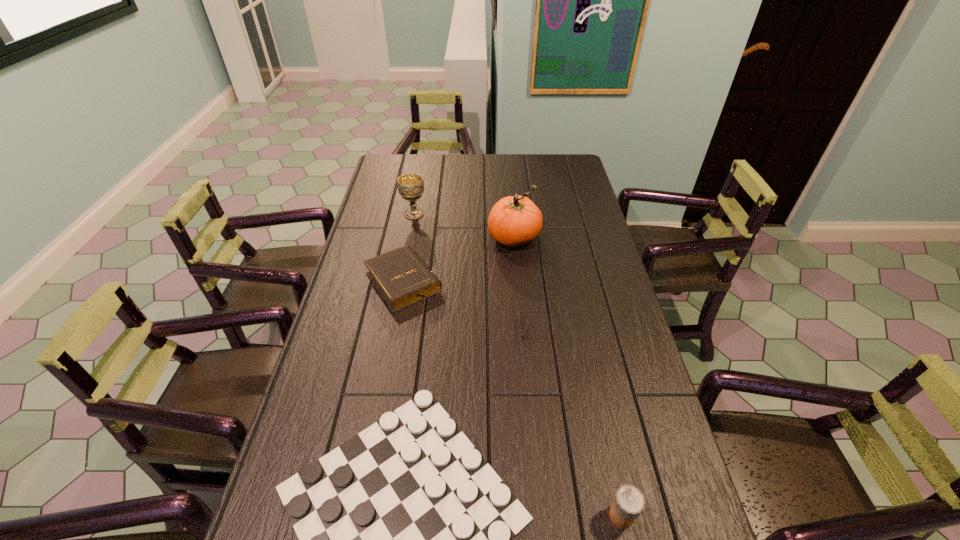
What are the coordinates of `free space at the far edge` in the screenshot? It's located at (444, 168).

You are a GUI agent. You are given a task and a screenshot of the screen. Output one action in this format:
    pyautogui.click(x=<x>, y=<y>)
    Task: Click on the blank space at the left edge of the desktop
    The width and height of the screenshot is (960, 540).
    Given the screenshot: What is the action you would take?
    pyautogui.click(x=369, y=243)

This screenshot has height=540, width=960. What are the coordinates of `vacant space at the right edge of the desktop` in the screenshot? It's located at (632, 377).

Where is `vacant point at the far left corner`? vacant point at the far left corner is located at coordinates (381, 175).

You are a GUI agent. You are given a task and a screenshot of the screen. Output one action in this format:
    pyautogui.click(x=<x>, y=<y>)
    Task: Click on the free space at the far right corner
    
    Given the screenshot: What is the action you would take?
    pyautogui.click(x=554, y=170)

Identify the location of free space between the third shortest object and the sunglasses. (472, 306).

The width and height of the screenshot is (960, 540). Find the location of `empty location between the tallest object and the medicine`. empty location between the tallest object and the medicine is located at coordinates (567, 376).

This screenshot has height=540, width=960. In order to click on free spot between the chalice and the medicine in this screenshot , I will do `click(517, 364)`.

Image resolution: width=960 pixels, height=540 pixels. I want to click on vacant space that's between the fifth tallest object and the rightmost object, so click(x=581, y=423).

Identify the location of empty space between the fourth farthest object and the pumpkin. (527, 284).